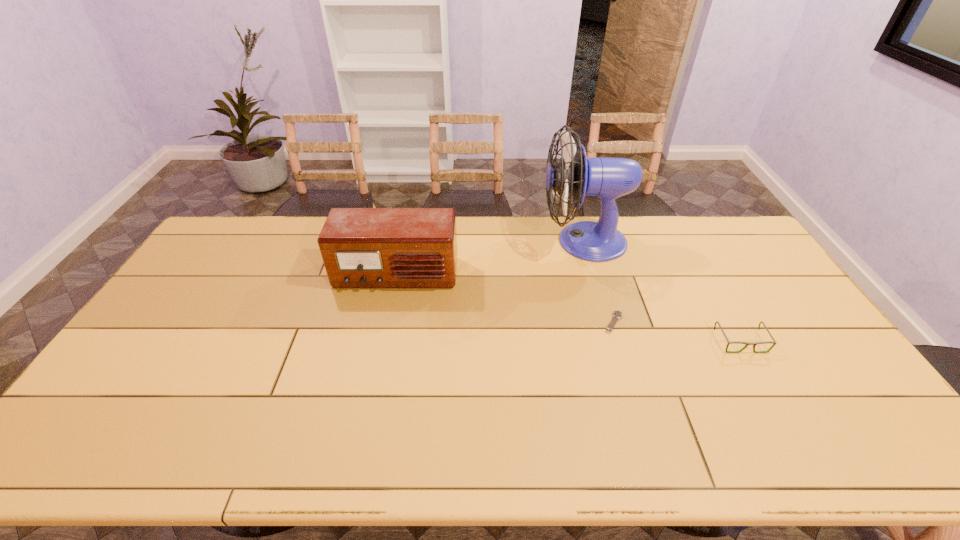
The image size is (960, 540). In order to click on the third closest object to the second tallest object in this screenshot , I will do `click(773, 342)`.

You are a GUI agent. You are given a task and a screenshot of the screen. Output one action in this format:
    pyautogui.click(x=<x>, y=<y>)
    Task: Click on the vacant point that satisfies the following two spatial constraints: 1. in front of the tallest object where the airflow is directed; 2. on the front-facing side of the leftmost object
    
    Given the screenshot: What is the action you would take?
    pyautogui.click(x=593, y=275)

Find the location of a particular element. The width and height of the screenshot is (960, 540). vacant space that satisfies the following two spatial constraints: 1. on the front-facing side of the radio receiver; 2. on the right side of the watch is located at coordinates (386, 322).

Locate an element on the screen. free space that satisfies the following two spatial constraints: 1. in front of the tallest object where the airflow is directed; 2. on the front-facing side of the radio receiver is located at coordinates (593, 275).

I want to click on blank area in the image that satisfies the following two spatial constraints: 1. in front of the fan where the airflow is directed; 2. on the front-facing side of the leftmost object, so click(x=593, y=275).

You are a GUI agent. You are given a task and a screenshot of the screen. Output one action in this format:
    pyautogui.click(x=<x>, y=<y>)
    Task: Click on the free region that satisfies the following two spatial constraints: 1. in front of the fan where the airflow is directed; 2. on the left side of the shortest object
    This screenshot has width=960, height=540.
    Given the screenshot: What is the action you would take?
    pyautogui.click(x=607, y=322)

You are a GUI agent. You are given a task and a screenshot of the screen. Output one action in this format:
    pyautogui.click(x=<x>, y=<y>)
    Task: Click on the free location that satisfies the following two spatial constraints: 1. in front of the fan where the airflow is directed; 2. on the right side of the watch
    The height and width of the screenshot is (540, 960).
    Given the screenshot: What is the action you would take?
    pyautogui.click(x=607, y=322)